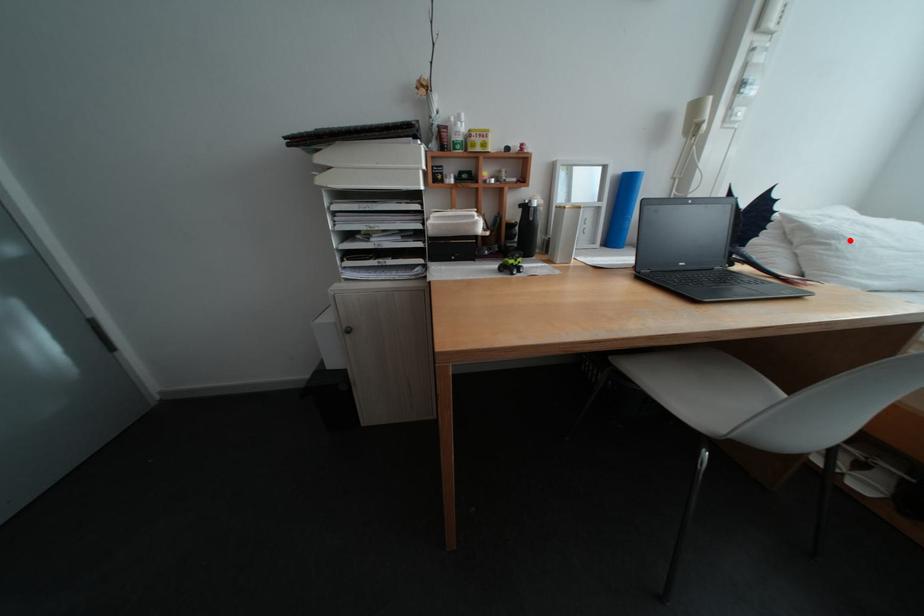
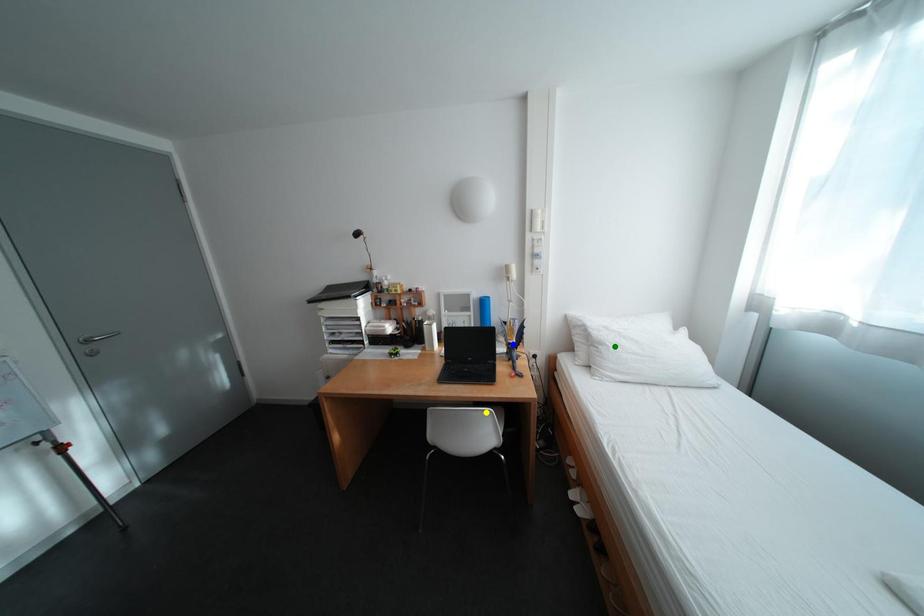
Question: I am providing you with two images of the same scene from different viewpoints. A red point is marked on the first image. You are given multiple points on the second image. Which point in image 2 represents the same 3d spot as the red point in image 1?

Choices:
 (A) green point
 (B) blue point
 (C) yellow point

Answer: (A)